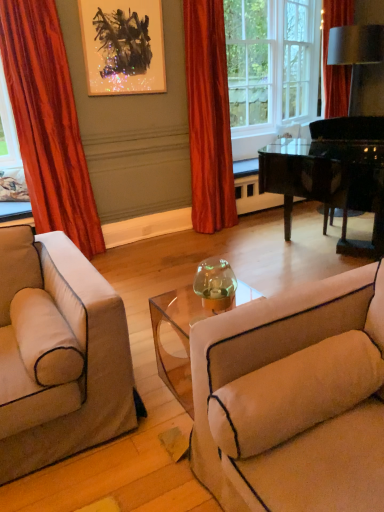
Question: Which direction should I rotate to face silky orange curtain at center, acting as the 2th curtain starting from the left, — up or down?

Choices:
 (A) up
 (B) down

Answer: (A)

Question: Should I look upward or downward to see metallic abstract art at upper center?

Choices:
 (A) up
 (B) down

Answer: (A)

Question: From the image's perspective, would you say black glossy piano at center right is shown under velvet orange curtain at left, the second curtain from the right?

Choices:
 (A) yes
 (B) no

Answer: (A)

Question: Considering the relative sizes of black glossy piano at center right and velvet orange curtain at left, the second curtain from the right, in the image provided, is black glossy piano at center right wider than velvet orange curtain at left, the second curtain from the right,?

Choices:
 (A) yes
 (B) no

Answer: (A)

Question: Considering the relative positions of black glossy piano at center right and velvet orange curtain at left, the second curtain from the right, in the image provided, is black glossy piano at center right to the right of velvet orange curtain at left, the second curtain from the right, from the viewer's perspective?

Choices:
 (A) yes
 (B) no

Answer: (A)

Question: Can you confirm if black glossy piano at center right is thinner than velvet orange curtain at left, acting as the first curtain starting from the left?

Choices:
 (A) yes
 (B) no

Answer: (B)

Question: Does black glossy piano at center right have a greater height compared to velvet orange curtain at left, the second curtain from the right?

Choices:
 (A) yes
 (B) no

Answer: (B)

Question: From a real-world perspective, is black glossy piano at center right physically below velvet orange curtain at left, the second curtain from the right?

Choices:
 (A) no
 (B) yes

Answer: (B)

Question: Considering the relative sizes of metallic abstract art at upper center and beige fabric couch at lower right in the image provided, is metallic abstract art at upper center taller than beige fabric couch at lower right?

Choices:
 (A) no
 (B) yes

Answer: (B)

Question: Is metallic abstract art at upper center smaller than beige fabric couch at lower right?

Choices:
 (A) no
 (B) yes

Answer: (B)

Question: Would you say beige fabric couch at lower right is part of metallic abstract art at upper center's contents?

Choices:
 (A) yes
 (B) no

Answer: (B)

Question: From a real-world perspective, is metallic abstract art at upper center positioned over beige fabric couch at lower right based on gravity?

Choices:
 (A) no
 (B) yes

Answer: (B)

Question: Is metallic abstract art at upper center oriented towards beige fabric couch at lower right?

Choices:
 (A) yes
 (B) no

Answer: (A)

Question: Does metallic abstract art at upper center have a greater width compared to beige fabric couch at lower right?

Choices:
 (A) yes
 (B) no

Answer: (B)

Question: Does white glass window frame at upper center have a lesser height compared to beige fabric couch at lower right?

Choices:
 (A) yes
 (B) no

Answer: (B)